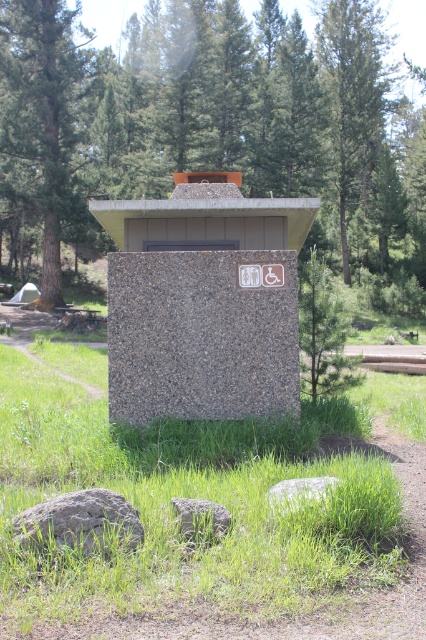
Question: Estimate the real-world distances between objects in this image. Which object is farther from the granite at center?

Choices:
 (A) green grass at center
 (B) gray rough rock at lower center
 (C) gray granite rock at lower center

Answer: (B)

Question: Can you confirm if green textured tree at center is positioned to the right of granite at center?

Choices:
 (A) no
 (B) yes

Answer: (A)

Question: Which object is positioned farthest from the granite at center?

Choices:
 (A) gray rough rock at lower center
 (B) gray rough rock at lower left

Answer: (B)

Question: Is green textured tree at center thinner than granite at center?

Choices:
 (A) no
 (B) yes

Answer: (A)

Question: Estimate the real-world distances between objects in this image. Which object is farther from the green grass at center?

Choices:
 (A) granite at center
 (B) green textured tree at center
 (C) gray granite rock at lower center
 (D) gray rough rock at lower left

Answer: (B)

Question: Does green textured tree at center appear on the right side of gray rough rock at lower left?

Choices:
 (A) yes
 (B) no

Answer: (B)